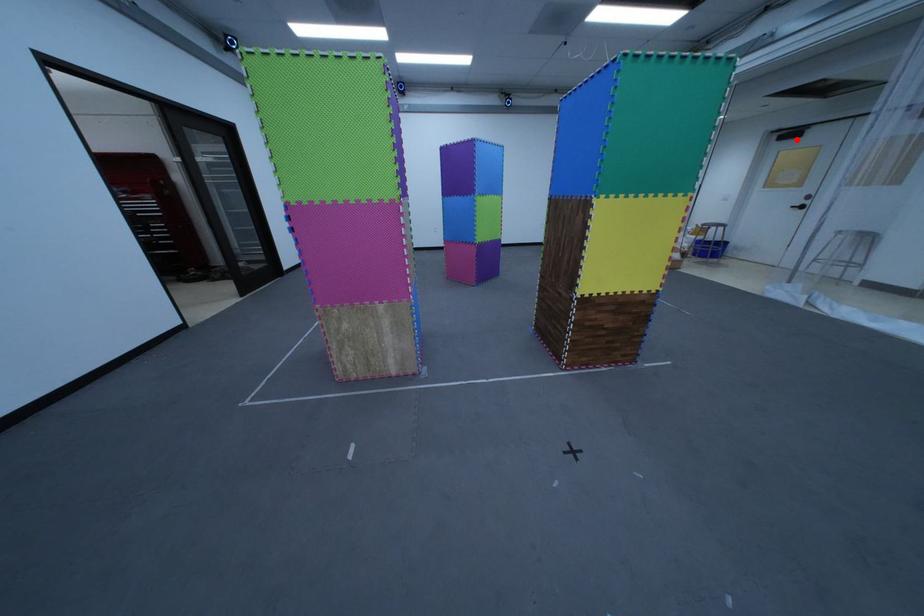
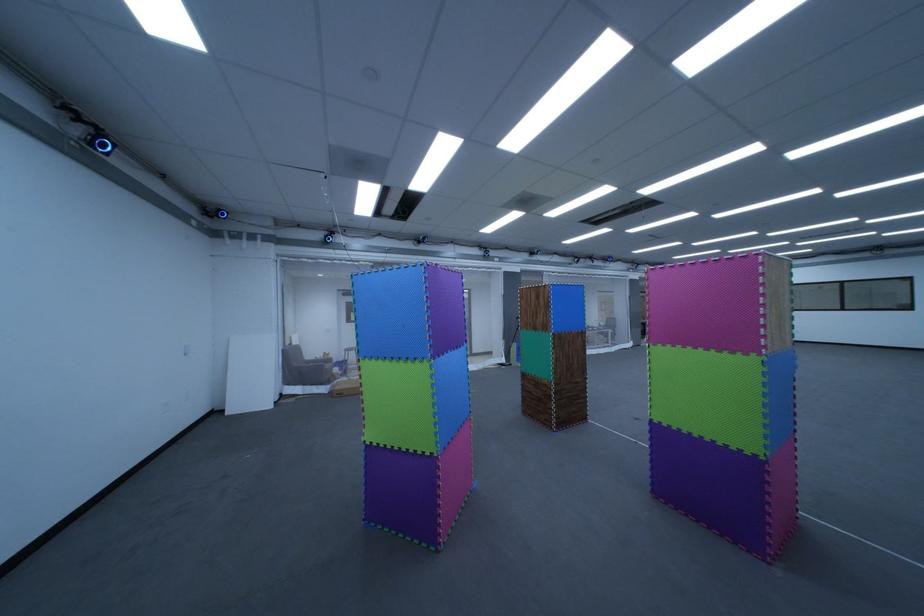
Question: I am providing you with two images of the same scene from different viewpoints. Given a red point in image1, look at the same physical point in image2. Is it:

Choices:
 (A) Closer to the viewpoint
 (B) Farther from the viewpoint

Answer: (A)